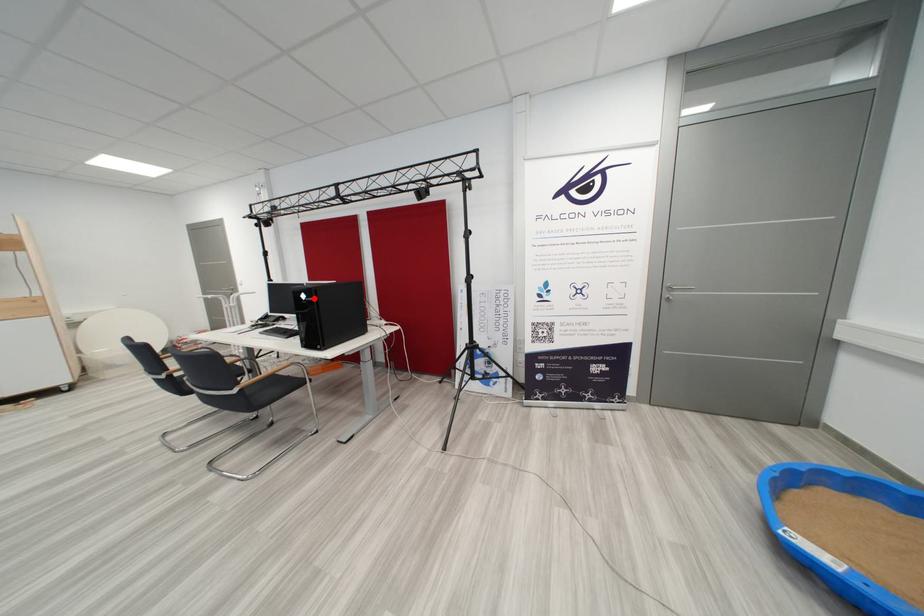
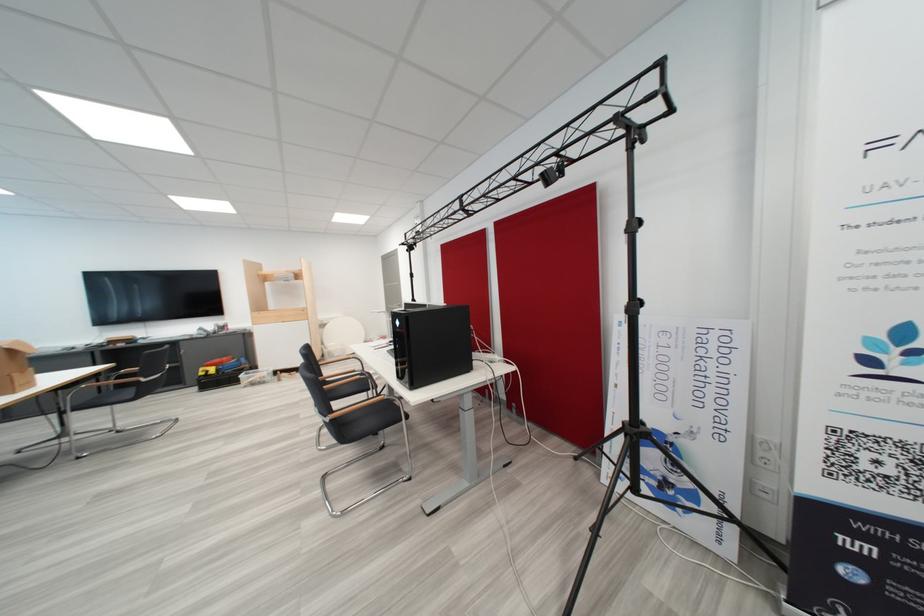
In the second image, find the point that corresponds to the highlighted location in the first image.

(407, 325)